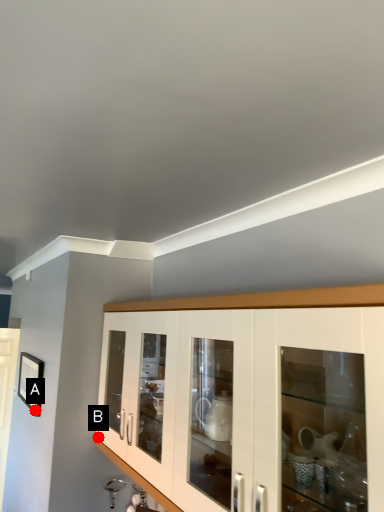
Question: Two points are circled on the image, labeled by A and B beside each circle. Which point is closer to the camera taking this photo?

Choices:
 (A) A is closer
 (B) B is closer

Answer: (B)